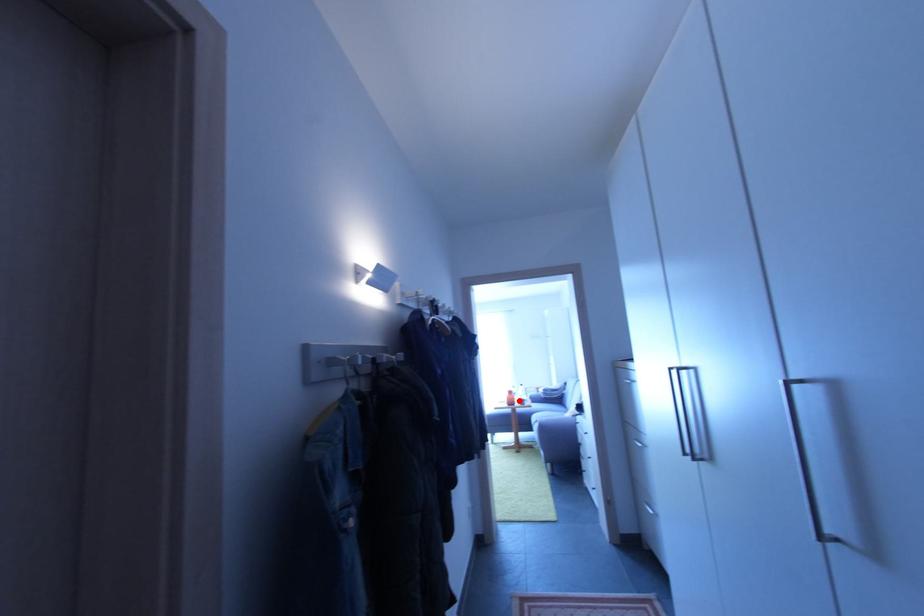
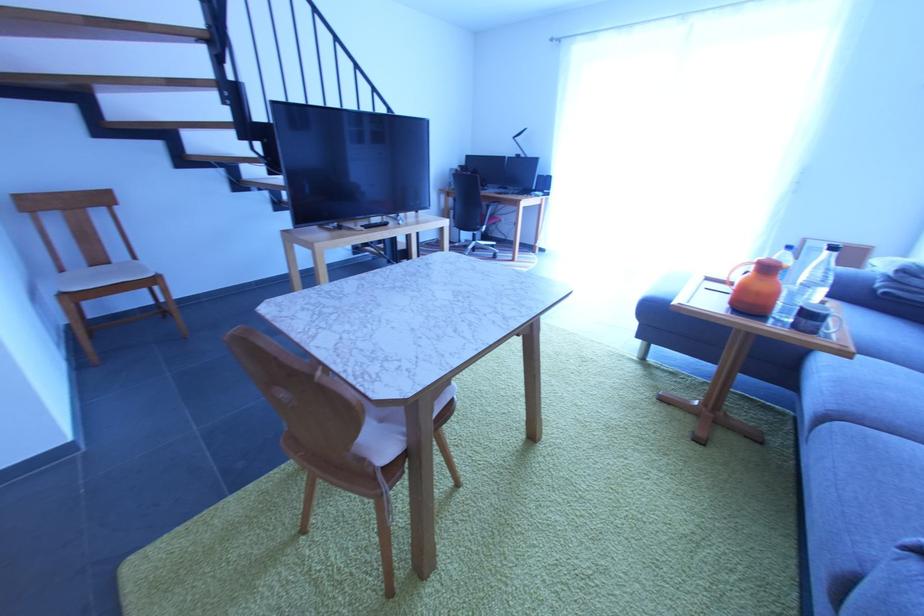
Find the pixel in the second image that matches the highlighted location in the first image.

(779, 297)